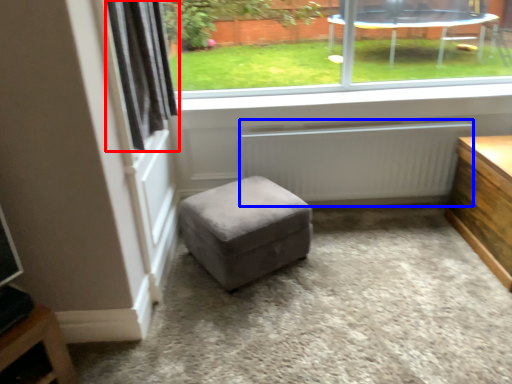
Question: Among these objects, which one is nearest to the camera, curtain (highlighted by a red box) or radiator (highlighted by a blue box)?

Choices:
 (A) curtain
 (B) radiator

Answer: (A)